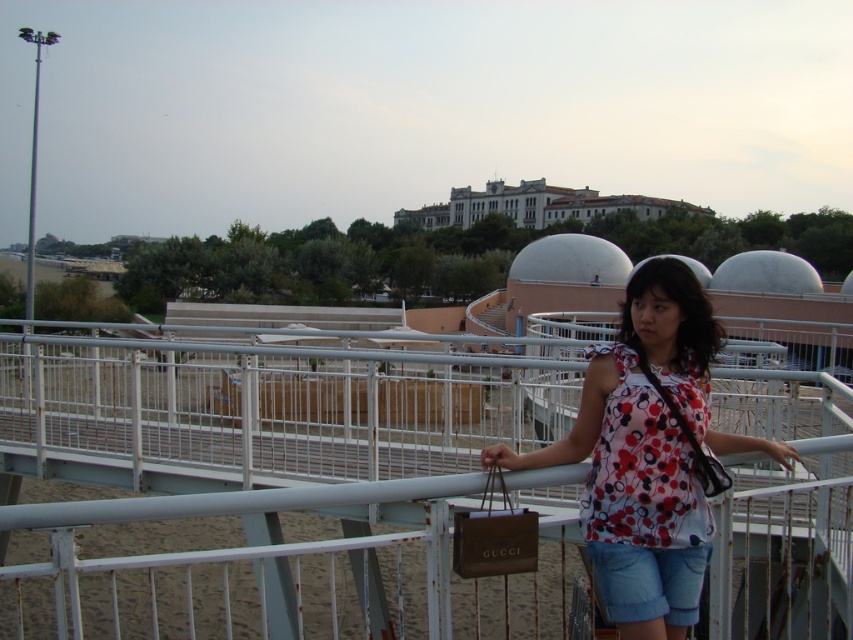
You are a lifeguard standing at the beach and you see a person wearing denim shorts at lower center and holding a brown leather bag at lower center. If you need to hand them an emergency whistle, which item should you aim for to reach them quickly?

You should aim for the brown leather bag at lower center because it is closer to you than the denim shorts at lower center, as the distance between them is 1.05 meters.

You are a fashion designer observing the beach scene. You notice the denim shorts at lower center and the brown leather bag at lower center. Which item takes up more space in the image?

The denim shorts at lower center takes up more space in the image as it is bigger than the brown leather bag at lower center.

You are planning to walk across the white metal pedestrian bridge at center while carrying the floral fabric blouse at center. Considering their sizes, will you have enough space to walk comfortably?

The white metal pedestrian bridge at center is larger in size compared to the floral fabric blouse at center, so there should be enough space to walk comfortably while carrying the blouse.